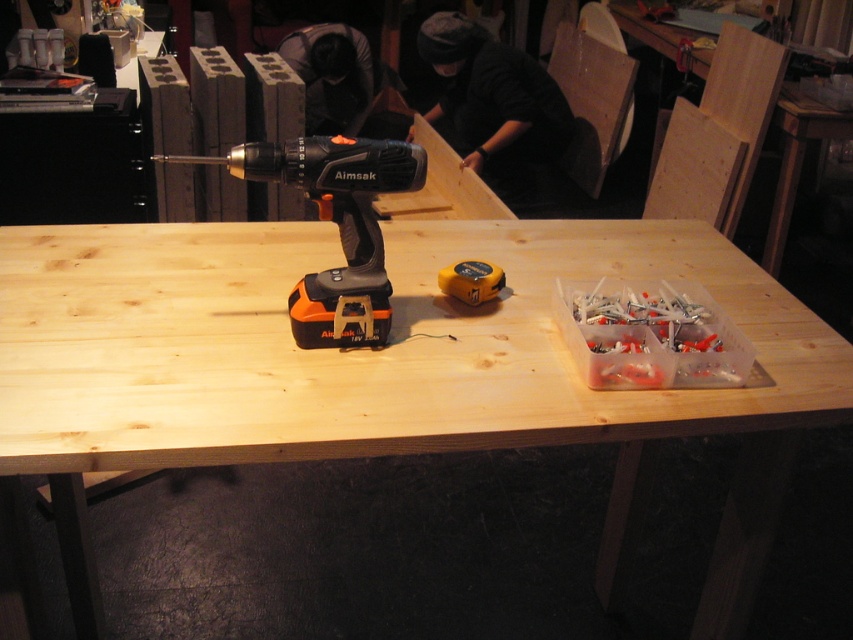
You are a worker who needs to reach the black plastic drill at center on the workbench. You are standing 1 meter away from the workbench. Can you comfortably reach the drill without moving closer?

The black plastic drill at center is 1.11 meters away from the viewer. Since you are standing 1 meter away from the workbench, you are 0.11 meters closer than the drill, so you can comfortably reach it without needing to move closer.